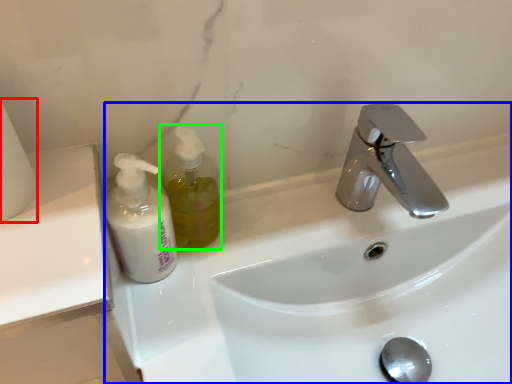
Question: Which object is the farthest from toilet paper (highlighted by a red box)? Choose among these: sink (highlighted by a blue box) or soap dispenser (highlighted by a green box).

Choices:
 (A) sink
 (B) soap dispenser

Answer: (A)